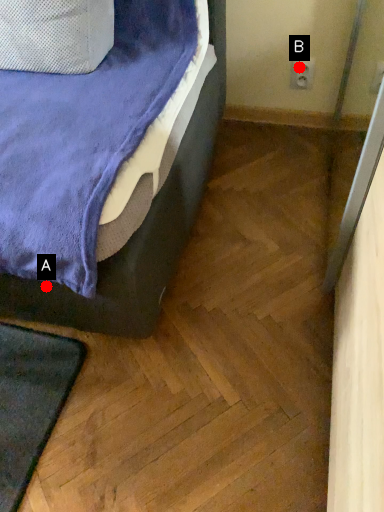
Question: Two points are circled on the image, labeled by A and B beside each circle. Which of the following is the farthest from the observer?

Choices:
 (A) A is further
 (B) B is further

Answer: (B)